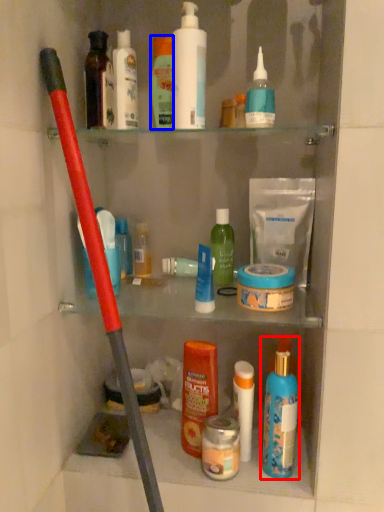
Question: Which object appears farthest to the camera in this image, toiletry (highlighted by a red box) or toiletry (highlighted by a blue box)?

Choices:
 (A) toiletry
 (B) toiletry

Answer: (B)